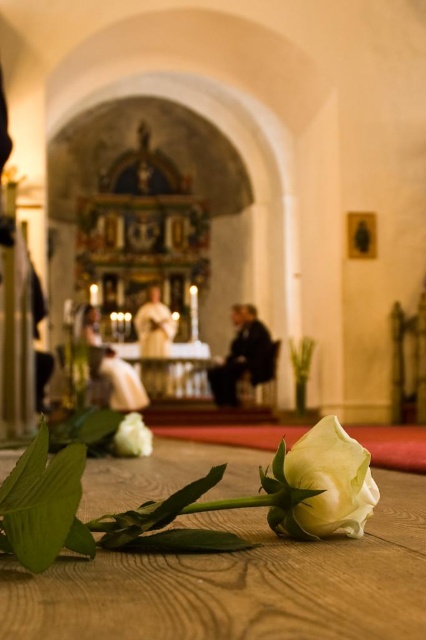
Question: Where is wooden table at lower center located in relation to white matte rose at center in the image?

Choices:
 (A) below
 (B) above

Answer: (A)

Question: From the image, what is the correct spatial relationship of white matte rose at center in relation to white matte rose at lower left?

Choices:
 (A) below
 (B) above

Answer: (B)

Question: Which object appears closest to the camera in this image?

Choices:
 (A) wooden table at lower center
 (B) white matte rose at lower left

Answer: (A)

Question: Which object appears farthest from the camera in this image?

Choices:
 (A) white matte rose at center
 (B) white matte rose at lower left
 (C) wooden table at lower center

Answer: (B)

Question: Does wooden table at lower center have a larger size compared to white matte rose at lower left?

Choices:
 (A) yes
 (B) no

Answer: (A)

Question: Estimate the real-world distances between objects in this image. Which object is farther from the wooden table at lower center?

Choices:
 (A) white matte rose at lower left
 (B) white matte rose at center

Answer: (A)